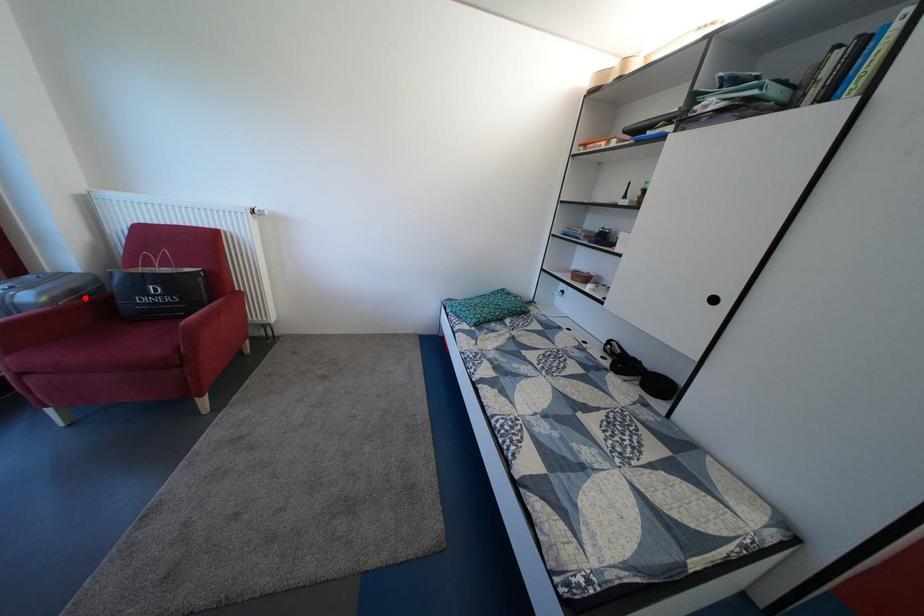
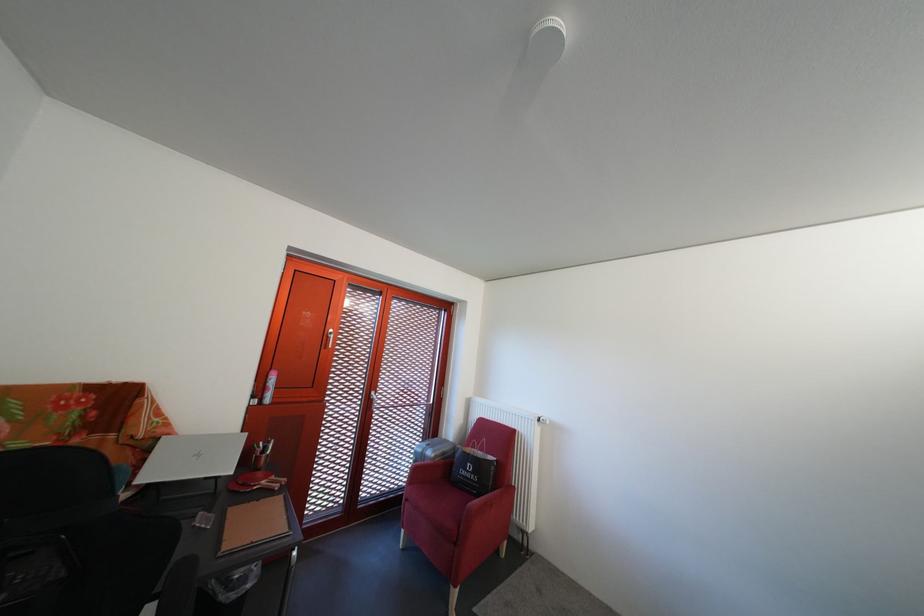
Question: I am providing you with two images of the same scene from different viewpoints. Given a red point in image1, look at the same physical point in image2. Is it:

Choices:
 (A) Closer to the viewpoint
 (B) Farther from the viewpoint

Answer: (B)